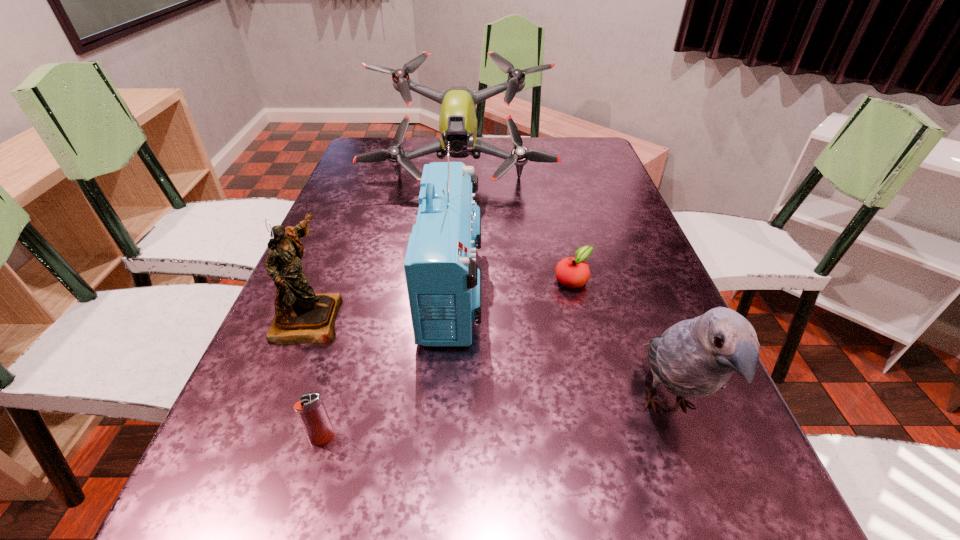
Locate an element on the screen. The height and width of the screenshot is (540, 960). free space located on the back of the second shortest object is located at coordinates (370, 274).

Where is `free location located on the left of the apple`? The image size is (960, 540). free location located on the left of the apple is located at coordinates (531, 280).

Image resolution: width=960 pixels, height=540 pixels. What are the coordinates of `object that is at the far edge` in the screenshot? It's located at (457, 122).

Find the location of a particular element. This screenshot has width=960, height=540. drone that is at the left edge is located at coordinates (457, 122).

This screenshot has width=960, height=540. In order to click on figurine that is at the left edge in this screenshot , I will do `click(301, 316)`.

The height and width of the screenshot is (540, 960). I want to click on igniter present at the left edge, so click(310, 410).

Identify the location of object that is at the right edge. This screenshot has height=540, width=960. (696, 357).

Find the location of a particular element. Image resolution: width=960 pixels, height=540 pixels. object situated at the far left corner is located at coordinates (457, 122).

Identify the location of vacant space at the far edge of the desktop. (465, 160).

The height and width of the screenshot is (540, 960). Identify the location of vacant space at the near edge of the desktop. (611, 538).